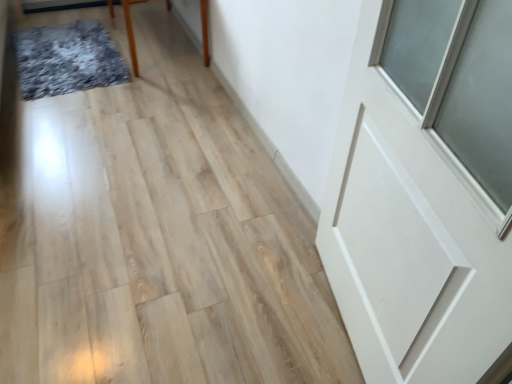
Where is `brown wooden table at upper left`? brown wooden table at upper left is located at coordinates (131, 32).

What is the approximate height of textured gray mat at upper left?

2.44 inches.

What is the approximate width of textured gray mat at upper left?

It is 1.08 meters.

The height and width of the screenshot is (384, 512). Identify the location of brown wooden table at upper left. (131, 32).

From the image's perspective, is textured gray mat at upper left located above or below white matte door at upper right?

Clearly, from the image's perspective, textured gray mat at upper left is above white matte door at upper right.

Considering the positions of point (50, 49) and point (485, 246), is point (50, 49) closer or farther from the camera than point (485, 246)?

Point (50, 49) is positioned farther from the camera compared to point (485, 246).

Is textured gray mat at upper left inside or outside of white matte door at upper right?

textured gray mat at upper left is not enclosed by white matte door at upper right.

From a real-world perspective, is textured gray mat at upper left on white matte door at upper right?

No, from a real-world perspective, textured gray mat at upper left is not over white matte door at upper right

Is white matte door at upper right smaller than brown wooden table at upper left?

Indeed, white matte door at upper right has a smaller size compared to brown wooden table at upper left.

Which is more to the left, white matte door at upper right or brown wooden table at upper left?

brown wooden table at upper left is more to the left.

From a real-world perspective, between white matte door at upper right and brown wooden table at upper left, who is vertically higher?

white matte door at upper right is physically above.

Is white matte door at upper right outside of brown wooden table at upper left?

Yes, white matte door at upper right is not within brown wooden table at upper left.

Is there a large distance between white matte door at upper right and textured gray mat at upper left?

Yes, white matte door at upper right is far from textured gray mat at upper left.

Who is bigger, white matte door at upper right or textured gray mat at upper left?

white matte door at upper right is bigger.

In terms of height, does white matte door at upper right look taller or shorter compared to textured gray mat at upper left?

white matte door at upper right is taller than textured gray mat at upper left.

Is textured gray mat at upper left facing towards brown wooden table at upper left?

No.

Is textured gray mat at upper left positioned beyond the bounds of brown wooden table at upper left?

textured gray mat at upper left lies outside brown wooden table at upper left's area.

From the image's perspective, does textured gray mat at upper left appear higher than brown wooden table at upper left?

No, from the image's perspective, textured gray mat at upper left is not on top of brown wooden table at upper left.

Is textured gray mat at upper left not near brown wooden table at upper left?

No, textured gray mat at upper left is not far from brown wooden table at upper left.

Considering the relative sizes of brown wooden table at upper left and textured gray mat at upper left in the image provided, is brown wooden table at upper left smaller than textured gray mat at upper left?

Actually, brown wooden table at upper left might be larger than textured gray mat at upper left.

Which object is further away from the camera taking this photo, brown wooden table at upper left or textured gray mat at upper left?

textured gray mat at upper left is behind.

Between brown wooden table at upper left and textured gray mat at upper left, which one appears on the left side from the viewer's perspective?

Positioned to the left is textured gray mat at upper left.

Is the surface of brown wooden table at upper left in direct contact with textured gray mat at upper left?

No, brown wooden table at upper left is not beside textured gray mat at upper left.

From a real-world perspective, is brown wooden table at upper left physically above white matte door at upper right?

Actually, brown wooden table at upper left is physically below white matte door at upper right in the real world.

Is brown wooden table at upper left taller than white matte door at upper right?

Incorrect, the height of brown wooden table at upper left is not larger of that of white matte door at upper right.

Which is behind, brown wooden table at upper left or white matte door at upper right?

brown wooden table at upper left is further away from the camera.

Is brown wooden table at upper left aimed at white matte door at upper right?

No, brown wooden table at upper left does not turn towards white matte door at upper right.

The width and height of the screenshot is (512, 384). In order to click on mat below the white matte door at upper right (from a real-world perspective) in this screenshot , I will do `click(67, 59)`.

Image resolution: width=512 pixels, height=384 pixels. I want to click on furniture located on the left of white matte door at upper right, so click(131, 32).

From the picture: Based on their spatial positions, is textured gray mat at upper left or white matte door at upper right closer to brown wooden table at upper left?

Among the two, textured gray mat at upper left is located nearer to brown wooden table at upper left.

Based on their spatial positions, is white matte door at upper right or textured gray mat at upper left further from brown wooden table at upper left?

The object further to brown wooden table at upper left is white matte door at upper right.

Looking at the image, which one is located further to textured gray mat at upper left, brown wooden table at upper left or white matte door at upper right?

white matte door at upper right.

Based on their spatial positions, is brown wooden table at upper left or textured gray mat at upper left closer to white matte door at upper right?

brown wooden table at upper left lies closer to white matte door at upper right than the other object.

Based on their spatial positions, is white matte door at upper right or brown wooden table at upper left further from textured gray mat at upper left?

The object further to textured gray mat at upper left is white matte door at upper right.

In the scene shown: When comparing their distances from white matte door at upper right, does textured gray mat at upper left or brown wooden table at upper left seem closer?

brown wooden table at upper left is closer to white matte door at upper right.

At what (x,y) coordinates should I click in order to perform the action: click on furniture between white matte door at upper right and textured gray mat at upper left along the z-axis. Please return your answer as a coordinate pair (x, y). The width and height of the screenshot is (512, 384). Looking at the image, I should click on (131, 32).